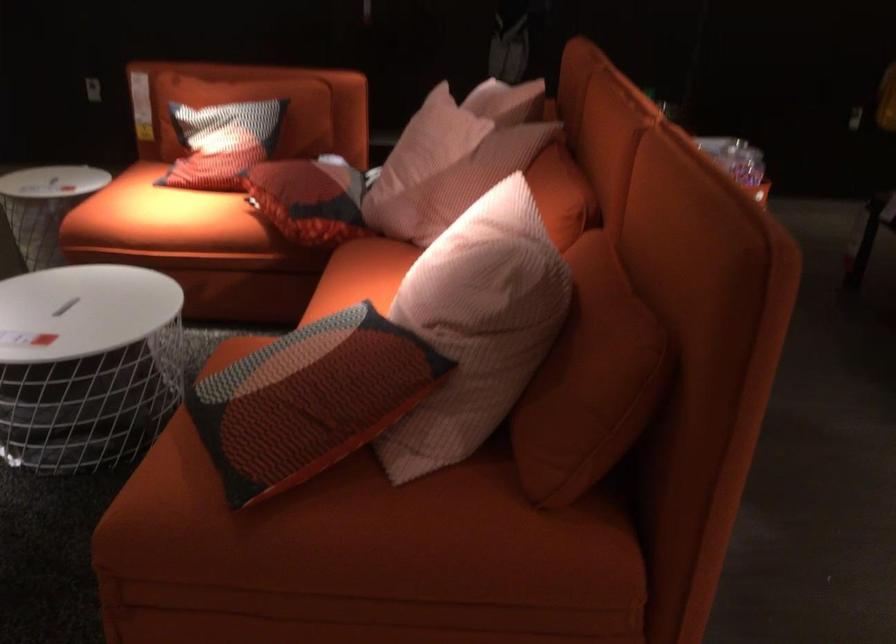
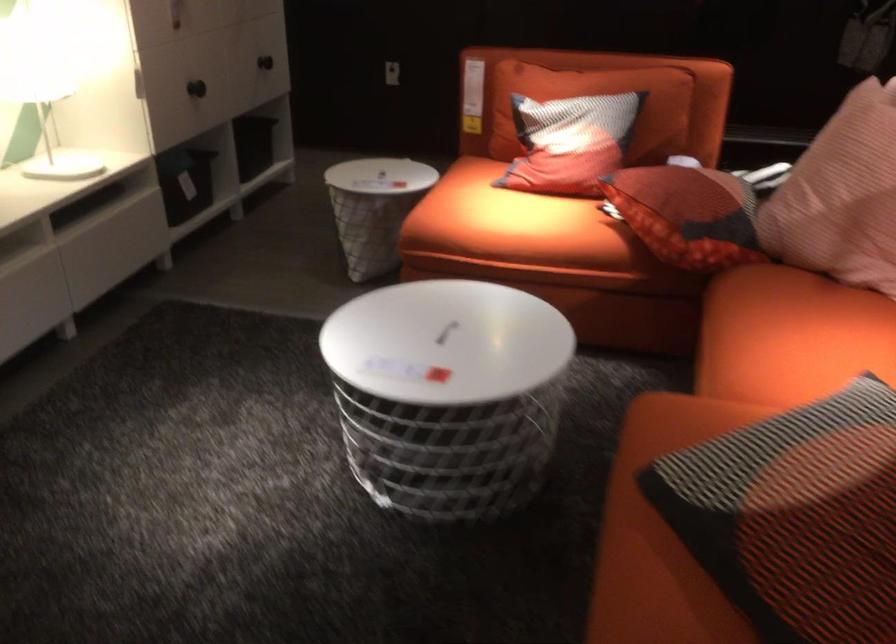
Question: The camera is either moving clockwise (left) or counter-clockwise (right) around the object. The first image is from the beginning of the video and the second image is from the end. Is the camera moving left or right when shooting the video?

Choices:
 (A) Left
 (B) Right

Answer: (B)